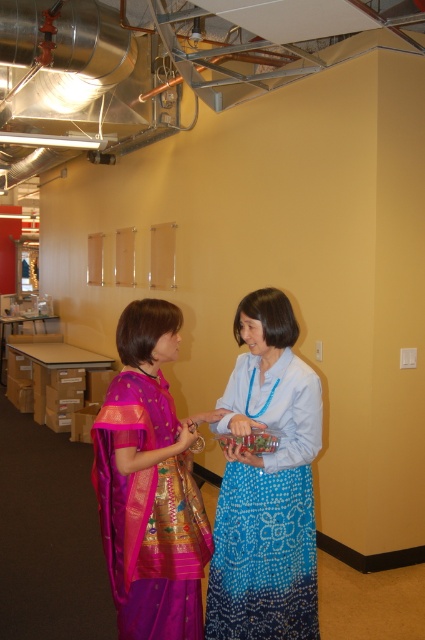
You are a fashion designer observing two outfits in the image. The outfits are the blue beaded skirt at center and the purple silk saree at center. Which outfit has a larger size?

The blue beaded skirt at center is bigger than the purple silk saree at center, so the blue beaded skirt at center has a larger size.

You are an interior designer assessing the layout of this office space. You notice the blue beaded skirt at center and the purple silk saree at center. Which of these two items is taller?

The blue beaded skirt at center is taller than the purple silk saree at center according to the description.